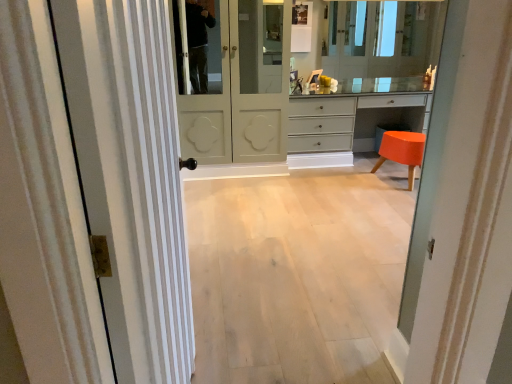
Find the location of a particular element. free spot to the left of orange glossy stool at lower right is located at coordinates (359, 187).